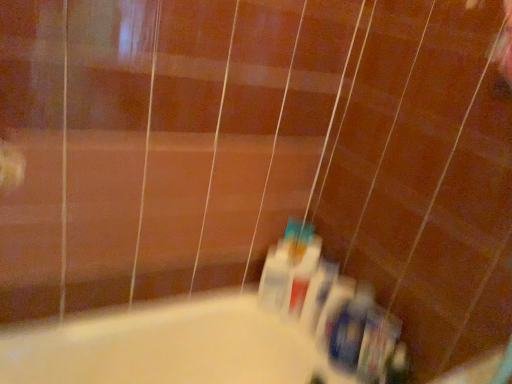
How much space does translucent plastic toothbrushes at lower center, the 4th toiletry viewed from the right, occupy horizontally?

7.59 centimeters.

This screenshot has height=384, width=512. Identify the location of white plastic mouthwash at lower center. (301, 268).

Identify the location of blue plastic toothbrush at lower right, which ranks as the 4th toiletry in left-to-right order. Image resolution: width=512 pixels, height=384 pixels. (349, 328).

Measure the distance between point [388,354] and camera.

The depth of point [388,354] is 34.45 inches.

In order to face translucent plastic toothbrush at center, positioned as the 3th toiletry in right-to-left order, should I rotate leftwards or rightwards?

A 10.644 degree turn to the right will do.

This screenshot has height=384, width=512. Find the location of `translucent plastic toothbrushes at lower center, the 4th toiletry viewed from the right`. translucent plastic toothbrushes at lower center, the 4th toiletry viewed from the right is located at coordinates (318, 293).

Which of these two, white plastic toothpaste tube at center, which ranks as the 5th toiletry in right-to-left order, or translucent plastic toothbrush at center, positioned as the 3th toiletry in right-to-left order, stands taller?

white plastic toothpaste tube at center, which ranks as the 5th toiletry in right-to-left order.

From the image's perspective, which one is positioned higher, white plastic toothpaste tube at center, arranged as the first toiletry when viewed from the left, or translucent plastic toothbrush at center, which is the third toiletry in left-to-right order?

From the image's view, white plastic toothpaste tube at center, arranged as the first toiletry when viewed from the left, is above.

Is translucent plastic toothbrush at center, positioned as the 3th toiletry in right-to-left order, located within white plastic toothpaste tube at center, arranged as the first toiletry when viewed from the left?

No, translucent plastic toothbrush at center, positioned as the 3th toiletry in right-to-left order, is not surrounded by white plastic toothpaste tube at center, arranged as the first toiletry when viewed from the left.

Is the surface of translucent plastic toothbrush at center, positioned as the 3th toiletry in right-to-left order, in direct contact with translucent plastic toothbrush at lower right, acting as the 1th toiletry starting from the right?

No.

From a real-world perspective, which object rests below the other?

translucent plastic toothbrush at center, positioned as the 3th toiletry in right-to-left order.

Which is more to the left, translucent plastic toothbrush at center, which is the third toiletry in left-to-right order, or translucent plastic toothbrush at lower right, the 5th toiletry when ordered from left to right?

From the viewer's perspective, translucent plastic toothbrush at center, which is the third toiletry in left-to-right order, appears more on the left side.

Is translucent plastic toothbrush at center, which is the third toiletry in left-to-right order, inside the boundaries of translucent plastic toothbrush at lower right, acting as the 1th toiletry starting from the right, or outside?

translucent plastic toothbrush at center, which is the third toiletry in left-to-right order, lies outside translucent plastic toothbrush at lower right, acting as the 1th toiletry starting from the right.

How many degrees apart are the facing directions of translucent plastic toothbrush at center, which is the third toiletry in left-to-right order, and white plastic toothpaste tube at center, arranged as the first toiletry when viewed from the left?

The angle between the facing direction of translucent plastic toothbrush at center, which is the third toiletry in left-to-right order, and the facing direction of white plastic toothpaste tube at center, arranged as the first toiletry when viewed from the left, is 11.8 degrees.

Does translucent plastic toothbrush at center, which is the third toiletry in left-to-right order, have a smaller size compared to white plastic toothpaste tube at center, which ranks as the 5th toiletry in right-to-left order?

Yes, translucent plastic toothbrush at center, which is the third toiletry in left-to-right order, is smaller than white plastic toothpaste tube at center, which ranks as the 5th toiletry in right-to-left order.

Does translucent plastic toothbrush at center, which is the third toiletry in left-to-right order, appear on the left side of white plastic toothpaste tube at center, which ranks as the 5th toiletry in right-to-left order?

Incorrect, translucent plastic toothbrush at center, which is the third toiletry in left-to-right order, is not on the left side of white plastic toothpaste tube at center, which ranks as the 5th toiletry in right-to-left order.

Does translucent plastic toothbrush at center, which is the third toiletry in left-to-right order, turn towards white plastic toothpaste tube at center, which ranks as the 5th toiletry in right-to-left order?

No, translucent plastic toothbrush at center, which is the third toiletry in left-to-right order, is not turned towards white plastic toothpaste tube at center, which ranks as the 5th toiletry in right-to-left order.

How distant is white plastic toothpaste tube at center, arranged as the first toiletry when viewed from the left, from translucent plastic toothbrushes at lower center, positioned as the 2th toiletry in left-to-right order?

white plastic toothpaste tube at center, arranged as the first toiletry when viewed from the left, is 3.63 inches away from translucent plastic toothbrushes at lower center, positioned as the 2th toiletry in left-to-right order.

Looking at the image, does white plastic toothpaste tube at center, which ranks as the 5th toiletry in right-to-left order, seem bigger or smaller compared to translucent plastic toothbrushes at lower center, the 4th toiletry viewed from the right?

Clearly, white plastic toothpaste tube at center, which ranks as the 5th toiletry in right-to-left order, is smaller in size than translucent plastic toothbrushes at lower center, the 4th toiletry viewed from the right.

Consider the image. Which of these two, white plastic toothpaste tube at center, which ranks as the 5th toiletry in right-to-left order, or translucent plastic toothbrushes at lower center, positioned as the 2th toiletry in left-to-right order, stands shorter?

white plastic toothpaste tube at center, which ranks as the 5th toiletry in right-to-left order, is shorter.

Considering the positions of objects white plastic toothpaste tube at center, which ranks as the 5th toiletry in right-to-left order, and white plastic mouthwash at lower center in the image provided, who is behind, white plastic toothpaste tube at center, which ranks as the 5th toiletry in right-to-left order, or white plastic mouthwash at lower center?

white plastic toothpaste tube at center, which ranks as the 5th toiletry in right-to-left order, is behind.

Between white plastic toothpaste tube at center, which ranks as the 5th toiletry in right-to-left order, and white plastic mouthwash at lower center, which one appears on the left side from the viewer's perspective?

white plastic toothpaste tube at center, which ranks as the 5th toiletry in right-to-left order.

Does white plastic toothpaste tube at center, arranged as the first toiletry when viewed from the left, turn towards white plastic mouthwash at lower center?

No, white plastic toothpaste tube at center, arranged as the first toiletry when viewed from the left, is not oriented towards white plastic mouthwash at lower center.

From the image's perspective, is white plastic toothpaste tube at center, which ranks as the 5th toiletry in right-to-left order, located above or below white plastic mouthwash at lower center?

Clearly, from the image's perspective, white plastic toothpaste tube at center, which ranks as the 5th toiletry in right-to-left order, is above white plastic mouthwash at lower center.

Which object is closer to the camera taking this photo, translucent plastic toothbrush at lower right, the 5th toiletry when ordered from left to right, or translucent plastic toothbrushes at lower center, positioned as the 2th toiletry in left-to-right order?

translucent plastic toothbrush at lower right, the 5th toiletry when ordered from left to right, is in front.

Is translucent plastic toothbrush at lower right, the 5th toiletry when ordered from left to right, not close to translucent plastic toothbrushes at lower center, positioned as the 2th toiletry in left-to-right order?

No, translucent plastic toothbrush at lower right, the 5th toiletry when ordered from left to right, is not far away from translucent plastic toothbrushes at lower center, positioned as the 2th toiletry in left-to-right order.

From the image's perspective, relative to translucent plastic toothbrushes at lower center, the 4th toiletry viewed from the right, is translucent plastic toothbrush at lower right, the 5th toiletry when ordered from left to right, above or below?

Clearly, from the image's perspective, translucent plastic toothbrush at lower right, the 5th toiletry when ordered from left to right, is below translucent plastic toothbrushes at lower center, the 4th toiletry viewed from the right.

Considering the relative sizes of white plastic toothpaste tube at center, which ranks as the 5th toiletry in right-to-left order, and translucent plastic toothbrush at lower right, acting as the 1th toiletry starting from the right, in the image provided, is white plastic toothpaste tube at center, which ranks as the 5th toiletry in right-to-left order, smaller than translucent plastic toothbrush at lower right, acting as the 1th toiletry starting from the right,?

Correct, white plastic toothpaste tube at center, which ranks as the 5th toiletry in right-to-left order, occupies less space than translucent plastic toothbrush at lower right, acting as the 1th toiletry starting from the right.

From a real-world perspective, count 2nd toiletrys downward from the translucent plastic toothbrush at lower right, acting as the 1th toiletry starting from the right, and point to it. Please provide its 2D coordinates.

[(276, 278)]

Considering the positions of objects white plastic toothpaste tube at center, arranged as the first toiletry when viewed from the left, and translucent plastic toothbrush at lower right, the 5th toiletry when ordered from left to right, in the image provided, who is more to the left, white plastic toothpaste tube at center, arranged as the first toiletry when viewed from the left, or translucent plastic toothbrush at lower right, the 5th toiletry when ordered from left to right,?

Positioned to the left is white plastic toothpaste tube at center, arranged as the first toiletry when viewed from the left.

Identify the location of toiletry beneath the translucent plastic toothbrush at center, which is the third toiletry in left-to-right order (from a real-world perspective). This screenshot has height=384, width=512. (276, 278).

Locate an element on the screen. the 2nd toiletry counting from the left of the translucent plastic toothbrush at lower right, acting as the 1th toiletry starting from the right is located at coordinates (333, 309).

Estimate the real-world distances between objects in this image. Which object is closer to translucent plastic toothbrush at center, positioned as the 3th toiletry in right-to-left order, white plastic toothpaste tube at center, arranged as the first toiletry when viewed from the left, or white plastic mouthwash at lower center?

white plastic mouthwash at lower center.

Considering their positions, is white plastic toothpaste tube at center, arranged as the first toiletry when viewed from the left, positioned closer to translucent plastic toothbrush at lower right, acting as the 1th toiletry starting from the right, than translucent plastic toothbrushes at lower center, the 4th toiletry viewed from the right?

translucent plastic toothbrushes at lower center, the 4th toiletry viewed from the right, is positioned closer to the anchor translucent plastic toothbrush at lower right, acting as the 1th toiletry starting from the right.

Looking at the image, which one is located further to blue plastic toothbrush at lower right, which ranks as the 4th toiletry in left-to-right order, translucent plastic toothbrush at center, which is the third toiletry in left-to-right order, or white plastic toothpaste tube at center, arranged as the first toiletry when viewed from the left?

white plastic toothpaste tube at center, arranged as the first toiletry when viewed from the left, lies further to blue plastic toothbrush at lower right, which ranks as the 4th toiletry in left-to-right order, than the other object.

When comparing their distances from translucent plastic toothbrush at lower right, acting as the 1th toiletry starting from the right, does white plastic toothpaste tube at center, which ranks as the 5th toiletry in right-to-left order, or white plastic mouthwash at lower center seem further?

white plastic toothpaste tube at center, which ranks as the 5th toiletry in right-to-left order, is further to translucent plastic toothbrush at lower right, acting as the 1th toiletry starting from the right.

When comparing their distances from translucent plastic toothbrush at lower right, acting as the 1th toiletry starting from the right, does white plastic mouthwash at lower center or blue plastic toothbrush at lower right, which ranks as the 4th toiletry in left-to-right order, seem further?

white plastic mouthwash at lower center lies further to translucent plastic toothbrush at lower right, acting as the 1th toiletry starting from the right, than the other object.

Based on the photo, considering their positions, is white plastic mouthwash at lower center positioned further to translucent plastic toothbrushes at lower center, the 4th toiletry viewed from the right, than blue plastic toothbrush at lower right, which ranks as the 4th toiletry in left-to-right order?

blue plastic toothbrush at lower right, which ranks as the 4th toiletry in left-to-right order, is further to translucent plastic toothbrushes at lower center, the 4th toiletry viewed from the right.

Based on their spatial positions, is white plastic toothpaste tube at center, which ranks as the 5th toiletry in right-to-left order, or translucent plastic toothbrush at lower right, the 5th toiletry when ordered from left to right, closer to translucent plastic toothbrush at center, which is the third toiletry in left-to-right order?

Based on the image, translucent plastic toothbrush at lower right, the 5th toiletry when ordered from left to right, appears to be nearer to translucent plastic toothbrush at center, which is the third toiletry in left-to-right order.

Based on the photo, based on their spatial positions, is translucent plastic toothbrush at lower right, acting as the 1th toiletry starting from the right, or translucent plastic toothbrush at center, which is the third toiletry in left-to-right order, closer to translucent plastic toothbrushes at lower center, positioned as the 2th toiletry in left-to-right order?

translucent plastic toothbrush at center, which is the third toiletry in left-to-right order, lies closer to translucent plastic toothbrushes at lower center, positioned as the 2th toiletry in left-to-right order, than the other object.

Find the location of a particular element. The height and width of the screenshot is (384, 512). toiletry situated between white plastic toothpaste tube at center, arranged as the first toiletry when viewed from the left, and translucent plastic toothbrush at center, which is the third toiletry in left-to-right order, from left to right is located at coordinates (318, 293).

Where is `mouthwash located between white plastic toothpaste tube at center, arranged as the first toiletry when viewed from the left, and translucent plastic toothbrush at center, positioned as the 3th toiletry in right-to-left order, in the left-right direction`? This screenshot has height=384, width=512. mouthwash located between white plastic toothpaste tube at center, arranged as the first toiletry when viewed from the left, and translucent plastic toothbrush at center, positioned as the 3th toiletry in right-to-left order, in the left-right direction is located at coordinates [301, 268].

I want to click on mouthwash between white plastic toothpaste tube at center, arranged as the first toiletry when viewed from the left, and translucent plastic toothbrushes at lower center, positioned as the 2th toiletry in left-to-right order, in the horizontal direction, so click(301, 268).

This screenshot has width=512, height=384. Find the location of `toiletry located between translucent plastic toothbrush at lower right, acting as the 1th toiletry starting from the right, and translucent plastic toothbrush at center, positioned as the 3th toiletry in right-to-left order, in the depth direction`. toiletry located between translucent plastic toothbrush at lower right, acting as the 1th toiletry starting from the right, and translucent plastic toothbrush at center, positioned as the 3th toiletry in right-to-left order, in the depth direction is located at coordinates (349, 328).